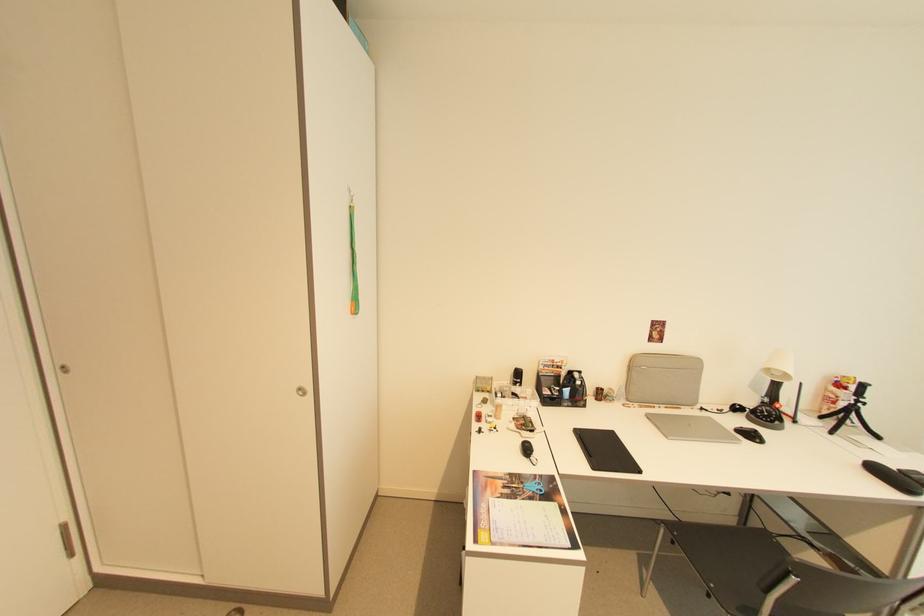
This screenshot has width=924, height=616. I want to click on grey laptop case, so click(663, 379).